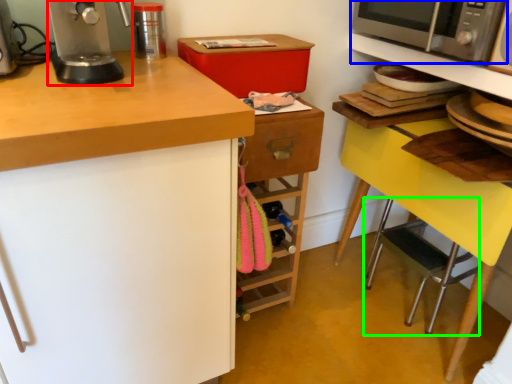
Question: Based on their relative distances, which object is farther from home appliance (highlighted by a red box)? Choose from microwave oven (highlighted by a blue box) and step stool (highlighted by a green box).

Choices:
 (A) microwave oven
 (B) step stool

Answer: (B)